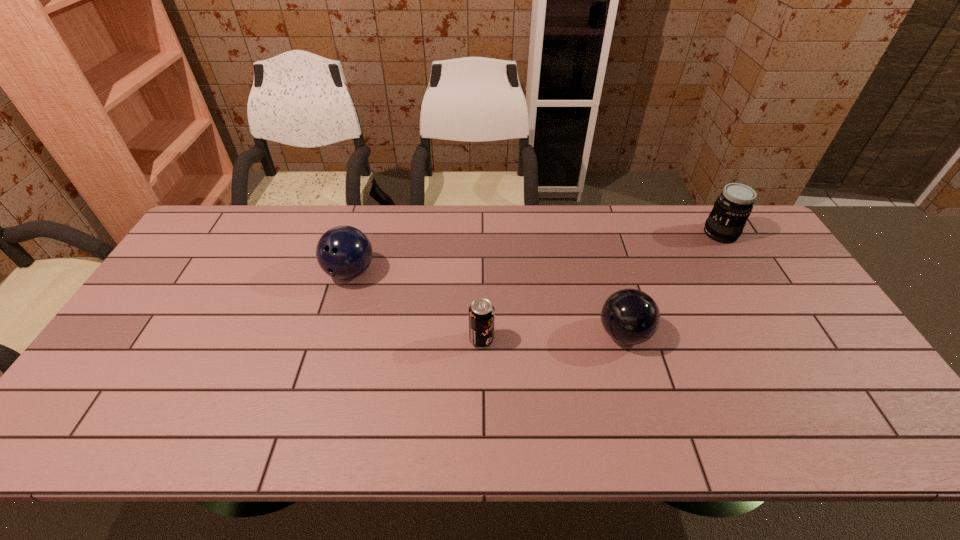
Image resolution: width=960 pixels, height=540 pixels. Identify the location of vacant space at the far left corner of the desktop. (212, 237).

In order to click on vacant region at the far right corner of the desktop in this screenshot , I will do `click(762, 246)`.

Identify the location of vacant space that's between the rightmost object and the second object from left to right. Image resolution: width=960 pixels, height=540 pixels. (601, 287).

This screenshot has height=540, width=960. In order to click on free space between the left bowling ball and the second object from left to right in this screenshot , I will do `click(416, 306)`.

This screenshot has width=960, height=540. I want to click on blank region between the rightmost object and the second farthest object, so (x=536, y=253).

Identify the location of free space between the third object from right to left and the telephoto lens. (601, 287).

Where is `free space that is in between the left bowling ball and the farthest object`? The height and width of the screenshot is (540, 960). free space that is in between the left bowling ball and the farthest object is located at coordinates (536, 253).

At what (x,y) coordinates should I click in order to perform the action: click on empty location between the soda can and the rightmost object. Please return your answer as a coordinate pair (x, y). Looking at the image, I should click on (601, 287).

The height and width of the screenshot is (540, 960). In order to click on empty space that is in between the rightmost object and the third object from right to left in this screenshot , I will do `click(601, 287)`.

Find the location of a particular element. This screenshot has width=960, height=540. free space between the right bowling ball and the telephoto lens is located at coordinates (672, 284).